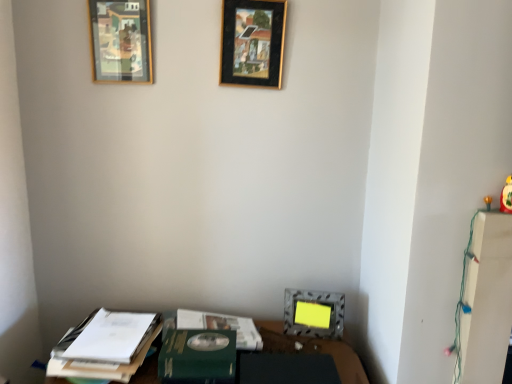
Question: Is the position of black matte picture frame at upper center, arranged as the second picture frame when viewed from the right, less distant than that of metallic silver picture frame at lower center, the 3th picture frame from the top?

Choices:
 (A) yes
 (B) no

Answer: (A)

Question: From a real-world perspective, is black matte picture frame at upper center, which is the 2th picture frame in top-to-bottom order, on metallic silver picture frame at lower center, acting as the 1th picture frame starting from the right?

Choices:
 (A) yes
 (B) no

Answer: (A)

Question: From a real-world perspective, is black matte picture frame at upper center, the second picture frame in the bottom-to-top sequence, positioned under metallic silver picture frame at lower center, acting as the first picture frame starting from the bottom, based on gravity?

Choices:
 (A) yes
 (B) no

Answer: (B)

Question: Is black matte picture frame at upper center, arranged as the second picture frame when viewed from the right, taller than metallic silver picture frame at lower center, the 3th picture frame from the top?

Choices:
 (A) no
 (B) yes

Answer: (B)

Question: Considering the relative sizes of black matte picture frame at upper center, the 2th picture frame in the left-to-right sequence, and metallic silver picture frame at lower center, acting as the 1th picture frame starting from the right, in the image provided, is black matte picture frame at upper center, the 2th picture frame in the left-to-right sequence, thinner than metallic silver picture frame at lower center, acting as the 1th picture frame starting from the right,?

Choices:
 (A) yes
 (B) no

Answer: (A)

Question: Does black matte picture frame at upper center, which is the 2th picture frame in top-to-bottom order, have a smaller size compared to metallic silver picture frame at lower center, acting as the first picture frame starting from the bottom?

Choices:
 (A) no
 (B) yes

Answer: (B)

Question: Does green matte journal at lower center have a greater height compared to yellow matte toy at right?

Choices:
 (A) yes
 (B) no

Answer: (B)

Question: Are green matte journal at lower center and yellow matte toy at right far apart?

Choices:
 (A) yes
 (B) no

Answer: (B)

Question: From the image's perspective, is green matte journal at lower center on top of yellow matte toy at right?

Choices:
 (A) yes
 (B) no

Answer: (B)

Question: Can you confirm if green matte journal at lower center is bigger than yellow matte toy at right?

Choices:
 (A) no
 (B) yes

Answer: (B)

Question: Does green matte journal at lower center have a smaller size compared to yellow matte toy at right?

Choices:
 (A) no
 (B) yes

Answer: (A)

Question: Could you tell me if green matte journal at lower center is turned towards yellow matte toy at right?

Choices:
 (A) no
 (B) yes

Answer: (A)

Question: Considering the relative positions of green matte paperback book at lower center and metallic silver picture frame at lower center, positioned as the 3th picture frame in left-to-right order, in the image provided, is green matte paperback book at lower center to the right of metallic silver picture frame at lower center, positioned as the 3th picture frame in left-to-right order, from the viewer's perspective?

Choices:
 (A) no
 (B) yes

Answer: (A)